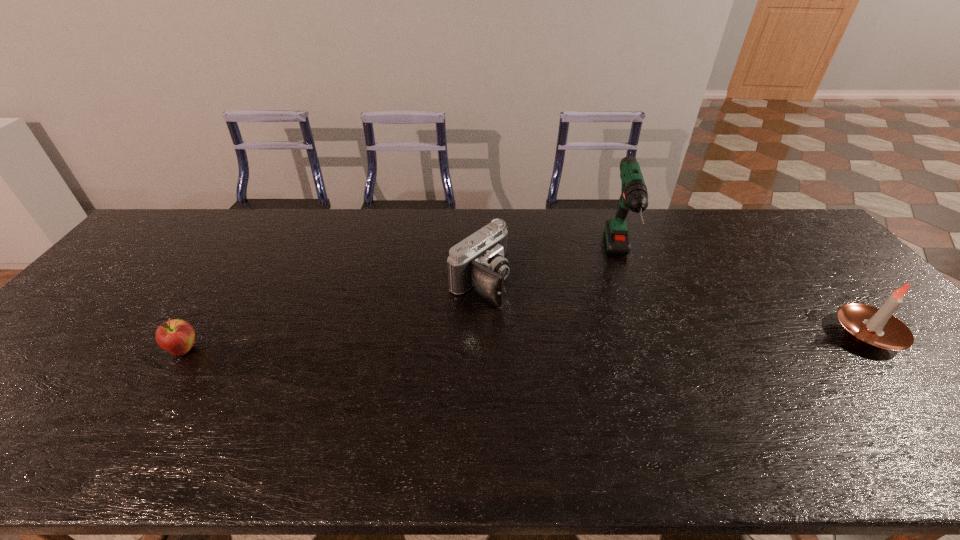
Identify the location of blank region between the third object from left to right and the candle. (744, 296).

Find the location of a particular element. This screenshot has width=960, height=540. free spot between the leftmost object and the candle is located at coordinates (526, 342).

Find the location of a particular element. This screenshot has width=960, height=540. vacant region between the apple and the third object from left to right is located at coordinates (402, 305).

In order to click on vacant space that is in between the drill and the rightmost object in this screenshot , I will do `click(744, 296)`.

Where is `vacant region between the second shortest object and the candle`? This screenshot has width=960, height=540. vacant region between the second shortest object and the candle is located at coordinates (673, 307).

You are a GUI agent. You are given a task and a screenshot of the screen. Output one action in this format:
    pyautogui.click(x=<x>, y=<y>)
    Task: Click on the vacant space in between the apple and the rightmost object
    
    Given the screenshot: What is the action you would take?
    pyautogui.click(x=526, y=342)

At what (x,y) coordinates should I click in order to perform the action: click on empty space that is in between the second object from left to right and the rightmost object. Please return your answer as a coordinate pair (x, y). Looking at the image, I should click on (673, 307).

This screenshot has height=540, width=960. Identify the location of empty space between the camera and the tallest object. (550, 271).

At what (x,y) coordinates should I click in order to perform the action: click on free spot between the second shortest object and the shortest object. Please return your answer as a coordinate pair (x, y). Looking at the image, I should click on (331, 315).

Image resolution: width=960 pixels, height=540 pixels. In order to click on empty space between the rightmost object and the tallest object in this screenshot , I will do `click(744, 296)`.